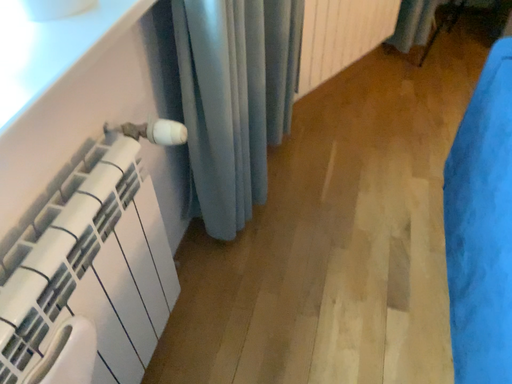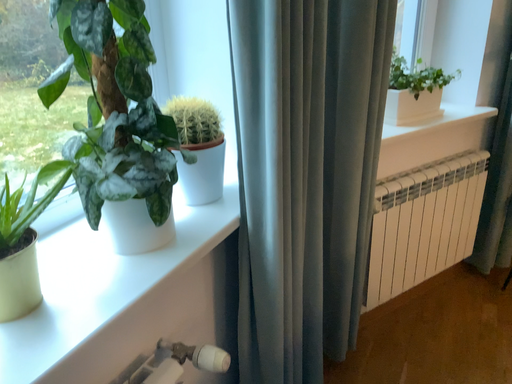
Question: Which way did the camera rotate in the video?

Choices:
 (A) rotated upward
 (B) rotated downward

Answer: (A)